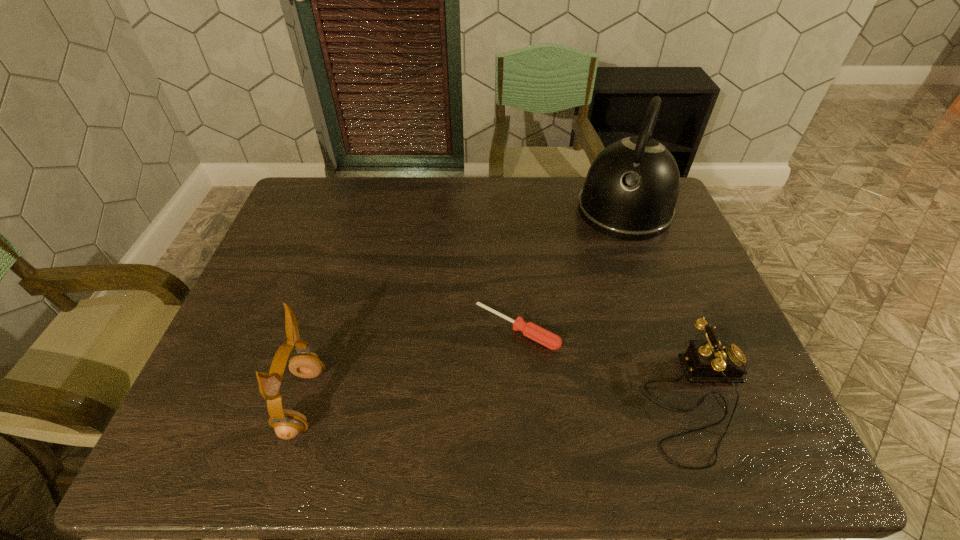
Locate an element on the screen. earphone is located at coordinates (287, 424).

Where is `the leftmost object`? The width and height of the screenshot is (960, 540). the leftmost object is located at coordinates (287, 424).

This screenshot has width=960, height=540. Identify the location of the third tallest object. (705, 361).

Where is `kettle`? The width and height of the screenshot is (960, 540). kettle is located at coordinates (630, 192).

Identify the location of the tallest object. The image size is (960, 540). (630, 192).

You are a GUI agent. You are given a task and a screenshot of the screen. Output one action in this format:
    pyautogui.click(x=<x>, y=<y>)
    Task: Click on the shortest object
    Image resolution: width=960 pixels, height=540 pixels.
    Given the screenshot: What is the action you would take?
    pyautogui.click(x=548, y=339)

Where is `screwdriver`? The width and height of the screenshot is (960, 540). screwdriver is located at coordinates (548, 339).

Find the location of `free space located on the front-facing side of the third shortest object`. free space located on the front-facing side of the third shortest object is located at coordinates (464, 402).

Find the location of a particular element. The image size is (960, 540). free space located on the spout of the kettle is located at coordinates (589, 307).

Locate an element on the screen. Image resolution: width=960 pixels, height=540 pixels. free region located 0.400m on the spout of the kettle is located at coordinates (579, 339).